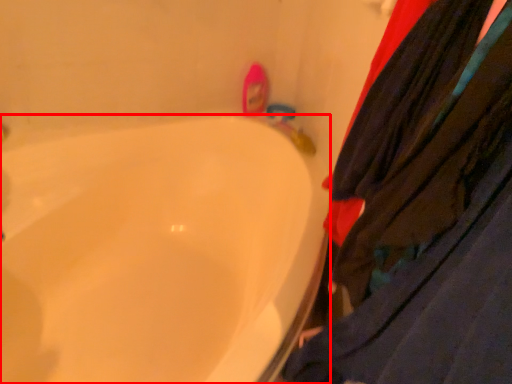
Question: Observing the image, what is the correct spatial positioning of bathtub (annotated by the red box) in reference to clothing?

Choices:
 (A) left
 (B) right

Answer: (A)